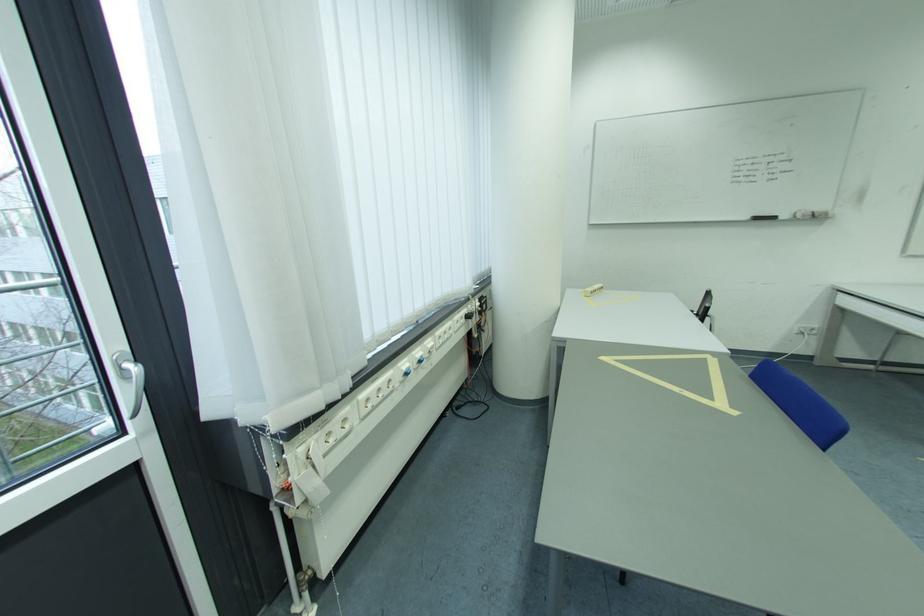
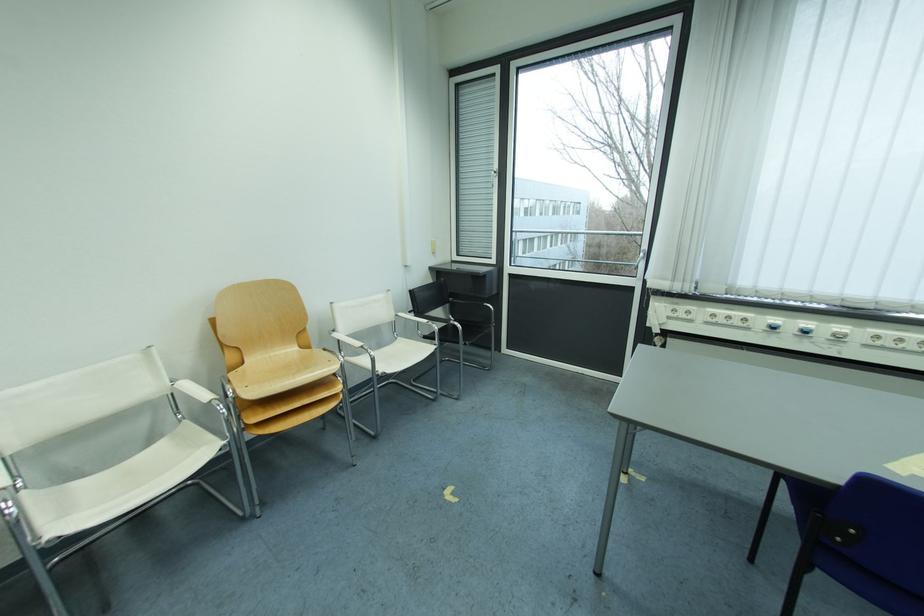
Find the pixel in the second image that matches (x=387, y=392) in the first image.

(737, 320)